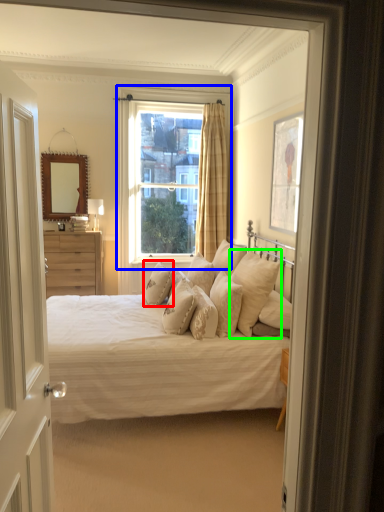
Question: Estimate the real-world distances between objects in this image. Which object is farther from pillow (highlighted by a red box), window (highlighted by a blue box) or pillow (highlighted by a green box)?

Choices:
 (A) window
 (B) pillow

Answer: (A)